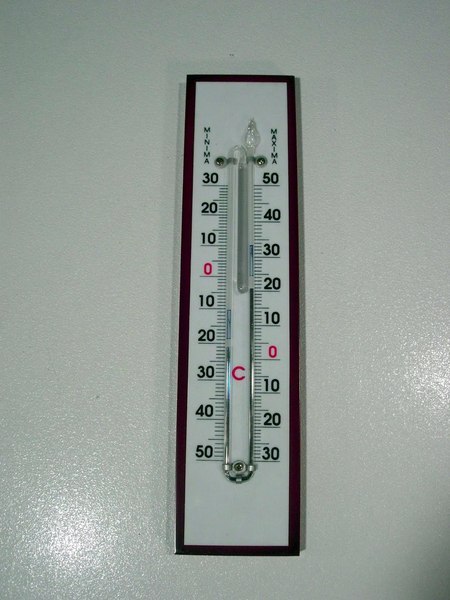
What are the coordinates of `wall` in the screenshot? It's located at (113, 491).